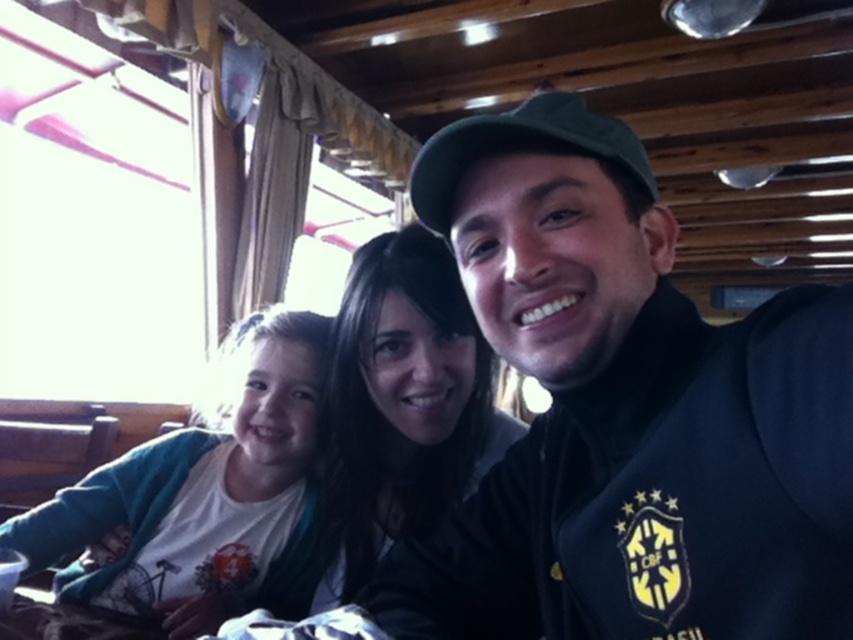
Question: Which point appears farthest from the camera in this image?

Choices:
 (A) (248, 531)
 (B) (801, 344)
 (C) (485, 406)

Answer: (A)

Question: Which of the following is the farthest from the observer?

Choices:
 (A) (531, 636)
 (B) (163, 513)
 (C) (352, 531)

Answer: (B)

Question: Can you confirm if white cotton shirt at left is wider than matte black jacket at center?

Choices:
 (A) no
 (B) yes

Answer: (B)

Question: Is dark blue fleece at center bigger than matte black jacket at center?

Choices:
 (A) yes
 (B) no

Answer: (A)

Question: Which point is closer to the camera?

Choices:
 (A) (489, 352)
 (B) (128, 572)

Answer: (A)

Question: Is dark blue fleece at center wider than matte black jacket at center?

Choices:
 (A) yes
 (B) no

Answer: (A)